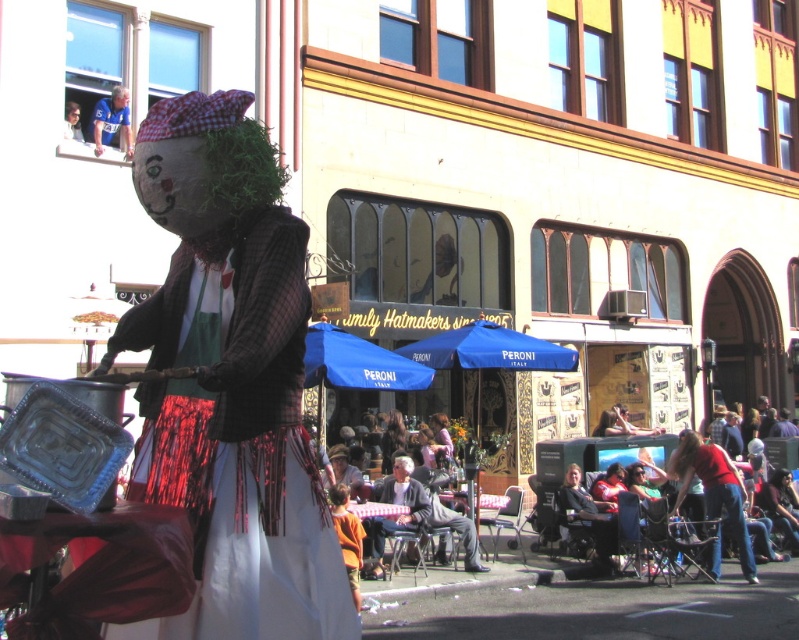
You are standing in the street scene and want to approach both the matte plaid shirt at center and the dark gray suit at center. Which one would you reach first?

You would reach the matte plaid shirt at center first because it is closer to you than the dark gray suit at center.

From the picture: You are a photographer at the event and want to capture both the matte plaid shirt at center and the dark gray suit at center in a single frame. Which direction should you move to ensure both are visible?

The matte plaid shirt at center is positioned on the left side of dark gray suit at center, so moving to the right of the dark gray suit at center would allow both objects to be captured in the frame.